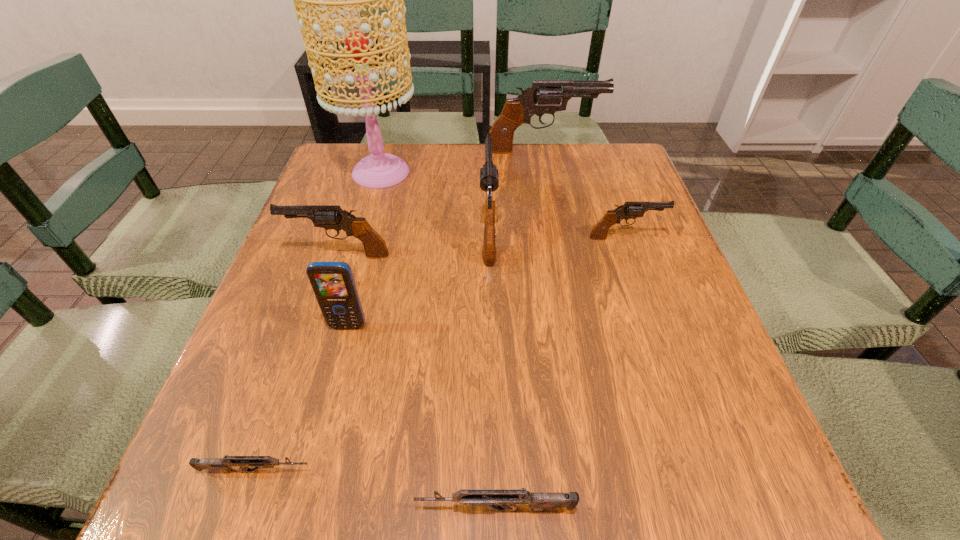
Locate an element on the screen. empty location between the nearest gun and the lampshade is located at coordinates (438, 341).

At what (x,y) coordinates should I click in order to perform the action: click on free space between the third smallest black gun and the tallest object. Please return your answer as a coordinate pair (x, y). Looking at the image, I should click on (435, 199).

This screenshot has width=960, height=540. Find the location of `vacant space that's between the tallest object and the nearest object`. vacant space that's between the tallest object and the nearest object is located at coordinates (438, 341).

Where is `vacant area that lies between the third tallest gun and the right grey gun`? This screenshot has height=540, width=960. vacant area that lies between the third tallest gun and the right grey gun is located at coordinates (417, 382).

Identify the location of vacant region between the third shortest gun and the second smallest black gun. (482, 246).

Image resolution: width=960 pixels, height=540 pixels. Identify the location of object that is the third closest to the fourth shortest gun. coord(489,180).

Locate which object is the third closest to the fifth tallest object. Please provide its 2D coordinates. Your answer should be formatted as a tuple, i.e. [(x, y)], where the tuple contains the x and y coordinates of a point satisfying the conditions above.

[(489, 180)]

Identify which gun is the fifth nearest to the fourth tallest gun. Please provide its 2D coordinates. Your answer should be formatted as a tuple, i.e. [(x, y)], where the tuple contains the x and y coordinates of a point satisfying the conditions above.

[(225, 464)]

At what (x,y) coordinates should I click in order to perform the action: click on gun that is the second closest one to the nearest gun. Please return your answer as a coordinate pair (x, y). This screenshot has height=540, width=960. Looking at the image, I should click on (489, 180).

The height and width of the screenshot is (540, 960). In order to click on black gun that is the closest one to the biggest black gun in this screenshot , I will do `click(489, 180)`.